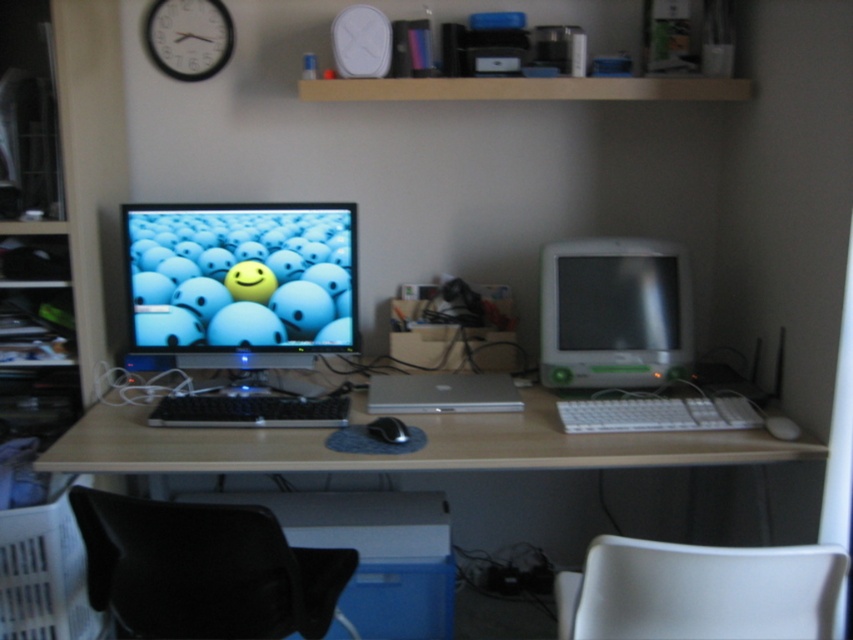
You are organizing a meeting in the home office and need to seat two people. There are two chairs available, the black leather swivel chair at lower left and the white plastic swivel chair at lower right. Which chair is positioned lower in the room?

The black leather swivel chair at lower left is located below the white plastic swivel chair at lower right, so it is positioned lower in the room.

You are standing in front of the desk in the home office. There are two points marked on the desk surface. The first point is at coordinates point (279,452) and the second is at point (686,609). If you want to place a small plant closer to you without moving the existing items, which point should you choose?

You should choose point (279,452) because it is closer to you than point (686,609).

You are organizing a small party in the home office and need to arrange seating for guests. Given the space occupied by the matte plastic monitor at center and the white plastic swivel chair at lower right, which object takes up more floor space and would require more careful placement to avoid blocking pathways?

The white plastic swivel chair at lower right occupies more floor space than the matte plastic monitor at center, so it would require more careful placement to avoid blocking pathways.